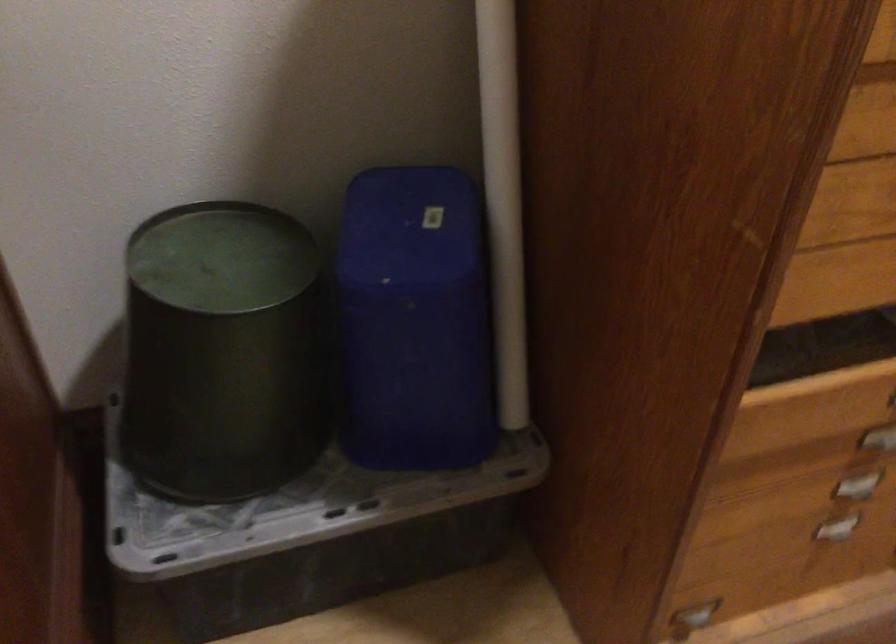
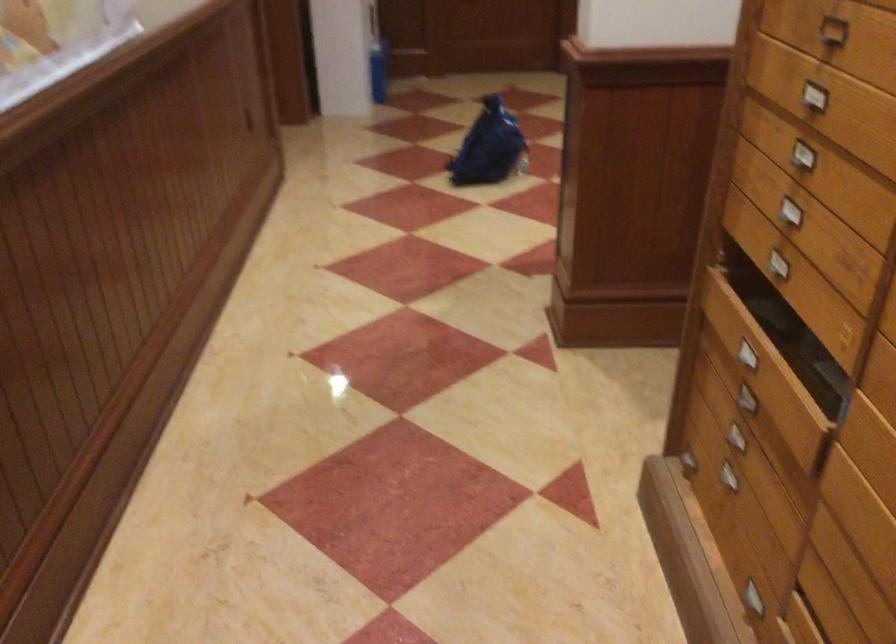
Locate, in the second image, the point that corresponds to point 803,552 in the first image.

(725, 476)